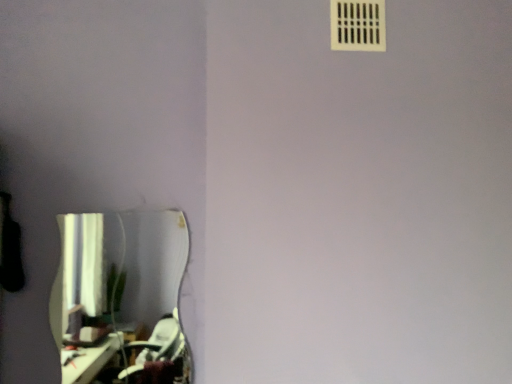
In order to face shiny silver mirror at lower left, should I rotate leftwards or rightwards?

Turn left by 17.121 degrees to look at shiny silver mirror at lower left.

Where is `shiny silver mirror at lower left`? shiny silver mirror at lower left is located at coordinates (120, 293).

What do you see at coordinates (120, 293) in the screenshot?
I see `shiny silver mirror at lower left` at bounding box center [120, 293].

Identify the location of shiny silver mirror at lower left. The width and height of the screenshot is (512, 384). (120, 293).